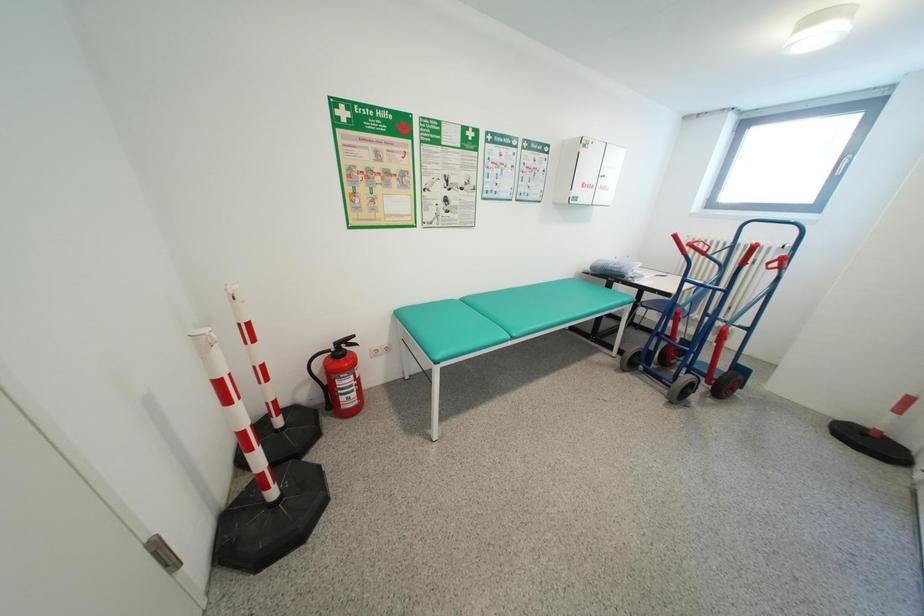
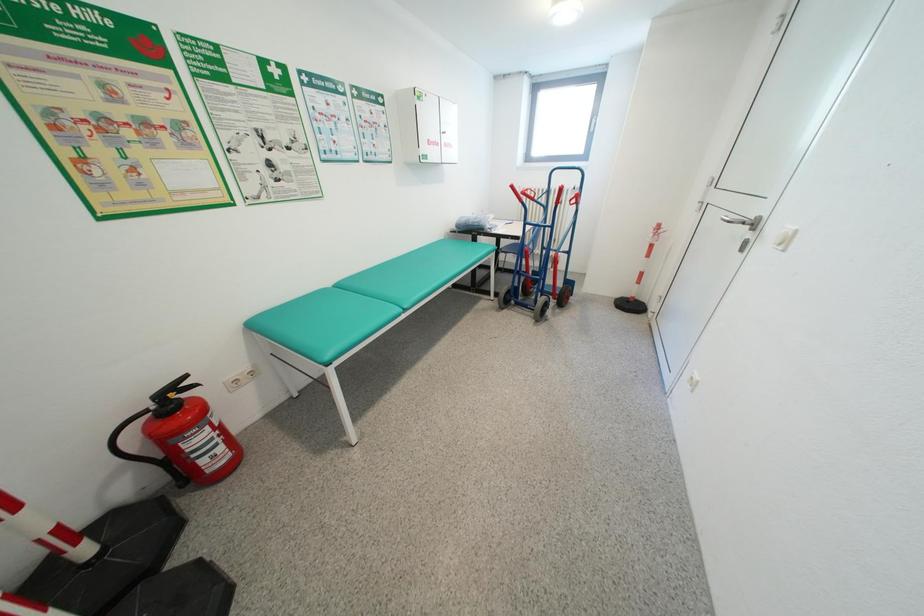
Question: The camera is either moving clockwise (left) or counter-clockwise (right) around the object. The first image is from the beginning of the video and the second image is from the end. Is the camera moving left or right when shooting the video?

Choices:
 (A) Left
 (B) Right

Answer: (A)